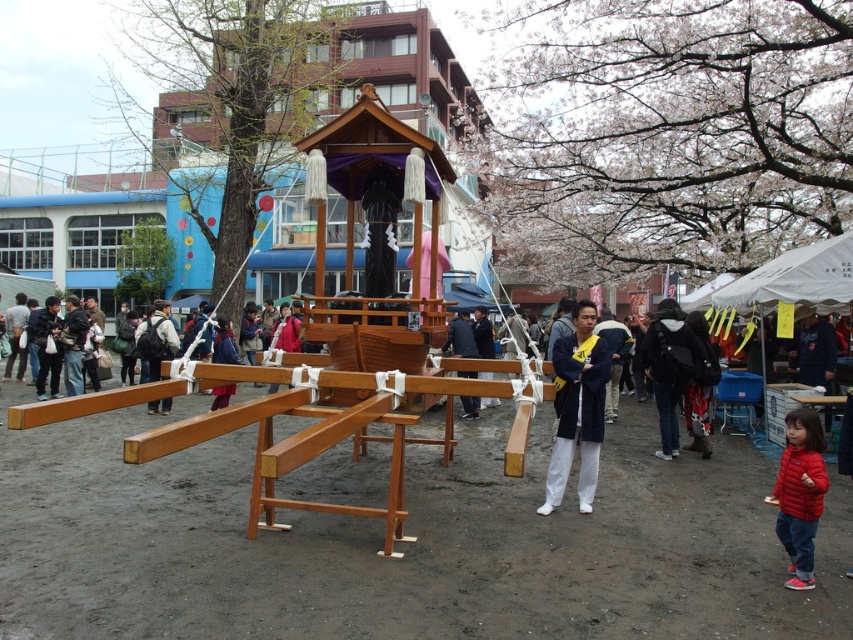
Is point (689, 332) positioned behind point (694, 314)?

No, it is in front of (694, 314).

This screenshot has width=853, height=640. Find the location of `dark blue fabric jacket at center`. dark blue fabric jacket at center is located at coordinates (669, 368).

Does blue silk kimono at center appear on the right side of red fleece jacket at lower right?

No, blue silk kimono at center is not to the right of red fleece jacket at lower right.

What do you see at coordinates (577, 408) in the screenshot?
I see `blue silk kimono at center` at bounding box center [577, 408].

Does point (550, 483) lie behind point (807, 445)?

Yes, it is.

Locate an element on the screen. blue silk kimono at center is located at coordinates click(x=577, y=408).

Is white fabric canopy at upper right below dark blue fabric jacket at center?

Actually, white fabric canopy at upper right is above dark blue fabric jacket at center.

Does white fabric canopy at upper right have a lesser height compared to dark blue fabric jacket at center?

Indeed, white fabric canopy at upper right has a lesser height compared to dark blue fabric jacket at center.

The height and width of the screenshot is (640, 853). Identify the location of white fabric canopy at upper right. coord(796,278).